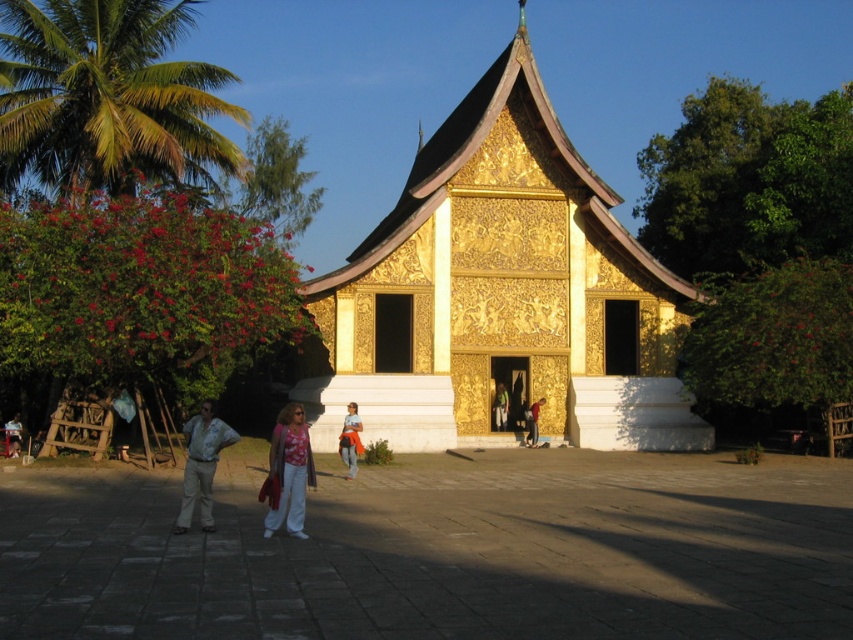
In the scene shown: You are standing in front of the temple and want to take a photo of the point marked at coordinates (577, 435). Considering the distance, can you estimate how far you need to walk to reach that point?

The point at coordinates (577, 435) is 68.85 meters away from the viewer, so you would need to walk approximately 68.85 meters to reach it.